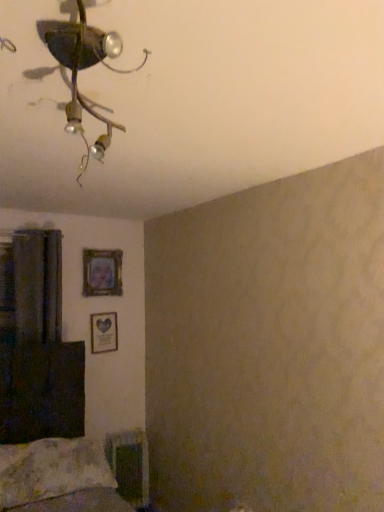
Where is `fluffy white pillow at lower left`? The height and width of the screenshot is (512, 384). fluffy white pillow at lower left is located at coordinates (51, 470).

Image resolution: width=384 pixels, height=512 pixels. What do you see at coordinates (102, 272) in the screenshot?
I see `matte wooden picture frame at upper left, which is the second picture frame in bottom-to-top order` at bounding box center [102, 272].

I want to click on wooden picture frame at center-left, which is the 1th picture frame from bottom to top, so click(104, 332).

This screenshot has width=384, height=512. What are the coordinates of `metallic ceiling fixture at upper left` in the screenshot? It's located at (82, 69).

Which object is positioned more to the right, metallic ceiling fixture at upper left or wooden picture frame at center-left, which is the 1th picture frame from bottom to top?

Positioned to the right is metallic ceiling fixture at upper left.

This screenshot has height=512, width=384. Identify the location of the 2nd picture frame positioned below the metallic ceiling fixture at upper left (from a real-world perspective). (104, 332).

From a real-world perspective, who is located lower, metallic ceiling fixture at upper left or wooden picture frame at center-left, marked as the second picture frame in a top-to-bottom arrangement?

wooden picture frame at center-left, marked as the second picture frame in a top-to-bottom arrangement, is physically lower.

Which object is thinner, metallic ceiling fixture at upper left or wooden picture frame at center-left, which is the 1th picture frame from bottom to top?

Thinner between the two is wooden picture frame at center-left, which is the 1th picture frame from bottom to top.

From the image's perspective, is metallic ceiling fixture at upper left positioned above or below matte wooden picture frame at upper left, acting as the 1th picture frame starting from the top?

Clearly, from the image's perspective, metallic ceiling fixture at upper left is above matte wooden picture frame at upper left, acting as the 1th picture frame starting from the top.

Is point (96, 155) positioned after point (85, 293)?

No, it is in front of (85, 293).

Is metallic ceiling fixture at upper left positioned with its back to matte wooden picture frame at upper left, acting as the 1th picture frame starting from the top?

Yes.

Where is `lamp on the right side of matte wooden picture frame at upper left, which is the second picture frame in bottom-to-top order`? lamp on the right side of matte wooden picture frame at upper left, which is the second picture frame in bottom-to-top order is located at coordinates (82, 69).

Is fluffy white pillow at lower left closer to the viewer compared to metallic ceiling fixture at upper left?

No, it is behind metallic ceiling fixture at upper left.

What's the angular difference between fluffy white pillow at lower left and metallic ceiling fixture at upper left's facing directions?

The angle between the facing direction of fluffy white pillow at lower left and the facing direction of metallic ceiling fixture at upper left is 28 degrees.

Considering the relative sizes of fluffy white pillow at lower left and metallic ceiling fixture at upper left in the image provided, is fluffy white pillow at lower left wider than metallic ceiling fixture at upper left?

No, fluffy white pillow at lower left is not wider than metallic ceiling fixture at upper left.

Who is smaller, fluffy white pillow at lower left or metallic ceiling fixture at upper left?

metallic ceiling fixture at upper left is smaller.

From the image's perspective, between dark brown fabric curtain at left and metallic ceiling fixture at upper left, which one is located above?

metallic ceiling fixture at upper left, from the image's perspective.

Between point (50, 233) and point (71, 120), which one is positioned behind?

The point (50, 233) is farther from the camera.

I want to click on lamp in front of the dark brown fabric curtain at left, so click(82, 69).

From a real-world perspective, who is located lower, dark brown fabric curtain at left or metallic ceiling fixture at upper left?

dark brown fabric curtain at left, from a real-world perspective.

Is dark brown fabric curtain at left turned away from wooden picture frame at center-left, which is the 1th picture frame from bottom to top?

No, wooden picture frame at center-left, which is the 1th picture frame from bottom to top, is not at the back of dark brown fabric curtain at left.

From the image's perspective, which one is positioned higher, dark brown fabric curtain at left or wooden picture frame at center-left, which is the 1th picture frame from bottom to top?

dark brown fabric curtain at left is shown above in the image.

Which of these two, dark brown fabric curtain at left or wooden picture frame at center-left, marked as the second picture frame in a top-to-bottom arrangement, is thinner?

wooden picture frame at center-left, marked as the second picture frame in a top-to-bottom arrangement, is thinner.

Does fluffy white pillow at lower left have a smaller size compared to matte wooden picture frame at upper left, acting as the 1th picture frame starting from the top?

No, fluffy white pillow at lower left is not smaller than matte wooden picture frame at upper left, acting as the 1th picture frame starting from the top.

From the image's perspective, is fluffy white pillow at lower left located above or below matte wooden picture frame at upper left, which is the second picture frame in bottom-to-top order?

fluffy white pillow at lower left is situated lower than matte wooden picture frame at upper left, which is the second picture frame in bottom-to-top order, in the image.

Is fluffy white pillow at lower left facing towards matte wooden picture frame at upper left, acting as the 1th picture frame starting from the top?

No.

From a real-world perspective, is fluffy white pillow at lower left above or below matte wooden picture frame at upper left, acting as the 1th picture frame starting from the top?

Clearly, from a real-world perspective, fluffy white pillow at lower left is below matte wooden picture frame at upper left, acting as the 1th picture frame starting from the top.

Is fluffy white pillow at lower left not close to wooden picture frame at center-left, marked as the second picture frame in a top-to-bottom arrangement?

Actually, fluffy white pillow at lower left and wooden picture frame at center-left, marked as the second picture frame in a top-to-bottom arrangement, are a little close together.

What's the angular difference between fluffy white pillow at lower left and wooden picture frame at center-left, marked as the second picture frame in a top-to-bottom arrangement,'s facing directions?

The angle between the facing direction of fluffy white pillow at lower left and the facing direction of wooden picture frame at center-left, marked as the second picture frame in a top-to-bottom arrangement, is 2.29 degrees.

Is fluffy white pillow at lower left outside of wooden picture frame at center-left, which is the 1th picture frame from bottom to top?

That's correct, fluffy white pillow at lower left is outside of wooden picture frame at center-left, which is the 1th picture frame from bottom to top.

Who is shorter, fluffy white pillow at lower left or wooden picture frame at center-left, marked as the second picture frame in a top-to-bottom arrangement?

fluffy white pillow at lower left is shorter.

Where is `lamp that appears on the right of wooden picture frame at center-left, which is the 1th picture frame from bottom to top`? The image size is (384, 512). lamp that appears on the right of wooden picture frame at center-left, which is the 1th picture frame from bottom to top is located at coordinates (82, 69).

Starting from the metallic ceiling fixture at upper left, which picture frame is the 2nd one to the left? Please provide its 2D coordinates.

[(102, 272)]

When comparing their distances from dark brown fabric curtain at left, does matte wooden picture frame at upper left, acting as the 1th picture frame starting from the top, or wooden picture frame at center-left, marked as the second picture frame in a top-to-bottom arrangement, seem further?

The object further to dark brown fabric curtain at left is wooden picture frame at center-left, marked as the second picture frame in a top-to-bottom arrangement.

Considering their positions, is metallic ceiling fixture at upper left positioned further to matte wooden picture frame at upper left, which is the second picture frame in bottom-to-top order, than wooden picture frame at center-left, which is the 1th picture frame from bottom to top?

Based on the image, metallic ceiling fixture at upper left appears to be further to matte wooden picture frame at upper left, which is the second picture frame in bottom-to-top order.

Considering their positions, is fluffy white pillow at lower left positioned closer to dark brown fabric curtain at left than matte wooden picture frame at upper left, which is the second picture frame in bottom-to-top order?

The object closer to dark brown fabric curtain at left is matte wooden picture frame at upper left, which is the second picture frame in bottom-to-top order.

Consider the image. Considering their positions, is matte wooden picture frame at upper left, which is the second picture frame in bottom-to-top order, positioned further to metallic ceiling fixture at upper left than dark brown fabric curtain at left?

matte wooden picture frame at upper left, which is the second picture frame in bottom-to-top order, is further to metallic ceiling fixture at upper left.

Considering their positions, is wooden picture frame at center-left, marked as the second picture frame in a top-to-bottom arrangement, positioned closer to metallic ceiling fixture at upper left than fluffy white pillow at lower left?

Among the two, fluffy white pillow at lower left is located nearer to metallic ceiling fixture at upper left.

Which object lies further to the anchor point dark brown fabric curtain at left, fluffy white pillow at lower left or wooden picture frame at center-left, which is the 1th picture frame from bottom to top?

The object further to dark brown fabric curtain at left is fluffy white pillow at lower left.

Considering their positions, is fluffy white pillow at lower left positioned further to matte wooden picture frame at upper left, acting as the 1th picture frame starting from the top, than dark brown fabric curtain at left?

The object further to matte wooden picture frame at upper left, acting as the 1th picture frame starting from the top, is fluffy white pillow at lower left.

Estimate the real-world distances between objects in this image. Which object is further from metallic ceiling fixture at upper left, wooden picture frame at center-left, marked as the second picture frame in a top-to-bottom arrangement, or dark brown fabric curtain at left?

wooden picture frame at center-left, marked as the second picture frame in a top-to-bottom arrangement, lies further to metallic ceiling fixture at upper left than the other object.

Find the location of a particular element. This screenshot has height=512, width=384. picture frame between fluffy white pillow at lower left and wooden picture frame at center-left, marked as the second picture frame in a top-to-bottom arrangement, along the z-axis is located at coordinates (102, 272).

This screenshot has height=512, width=384. I want to click on curtain between metallic ceiling fixture at upper left and wooden picture frame at center-left, which is the 1th picture frame from bottom to top, along the z-axis, so click(x=38, y=285).

Identify the location of pillow located between metallic ceiling fixture at upper left and wooden picture frame at center-left, marked as the second picture frame in a top-to-bottom arrangement, in the depth direction. The image size is (384, 512). (51, 470).

This screenshot has width=384, height=512. What are the coordinates of `pillow between metallic ceiling fixture at upper left and dark brown fabric curtain at left in the front-back direction` in the screenshot? It's located at (51, 470).